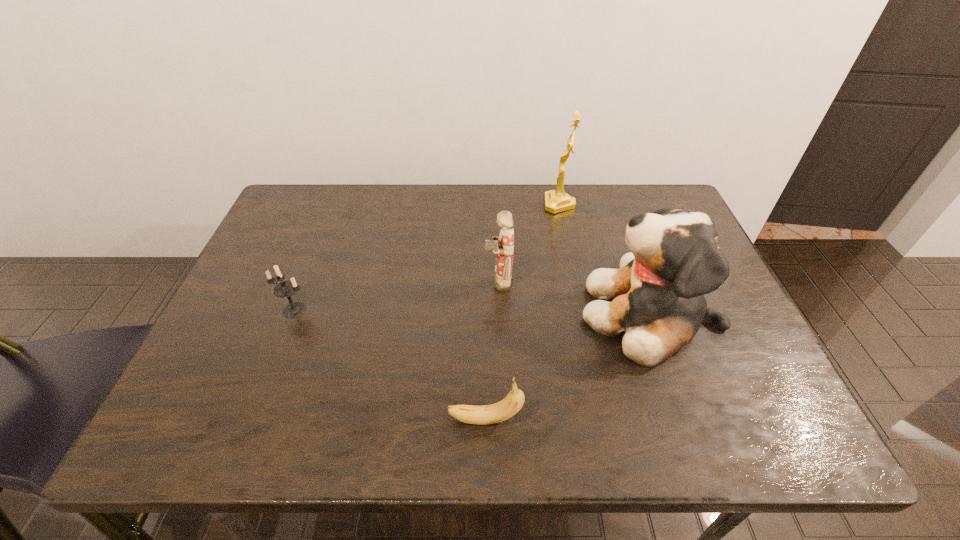
Where is `vacant space that's between the figurine and the farthest object`? Image resolution: width=960 pixels, height=540 pixels. vacant space that's between the figurine and the farthest object is located at coordinates (529, 243).

In order to click on vacant space in between the figurine and the puppy in this screenshot , I will do `click(574, 298)`.

Locate an element on the screen. The image size is (960, 540). vacant area that lies between the nearest object and the puppy is located at coordinates (567, 367).

At what (x,y) coordinates should I click in order to perform the action: click on vacant area that lies between the puppy and the farthest object. Please return your answer as a coordinate pair (x, y). Looking at the image, I should click on (605, 259).

Locate an element on the screen. free point between the leftmost object and the award is located at coordinates (427, 258).

Image resolution: width=960 pixels, height=540 pixels. I want to click on empty location between the third shortest object and the farthest object, so click(529, 243).

The width and height of the screenshot is (960, 540). Identify the location of free spot between the candle holder and the puppy. (472, 312).

The height and width of the screenshot is (540, 960). I want to click on free space between the banana and the award, so click(522, 312).

The height and width of the screenshot is (540, 960). In order to click on object that is the second closest to the banana in this screenshot , I will do `click(503, 246)`.

Select which object appears as the fourth closest to the figurine. Please provide its 2D coordinates. Your answer should be formatted as a tuple, i.e. [(x, y)], where the tuple contains the x and y coordinates of a point satisfying the conditions above.

[(285, 289)]